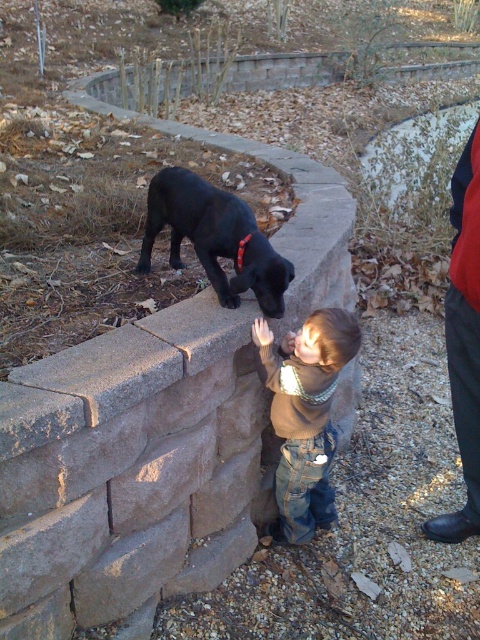
You are standing in the garden and see the black matte dog at upper center and the red fabric pants at right. Which object is positioned to the left of the other?

The black matte dog at upper center is to the left of red fabric pants at right.

You are a photographer setting up a shot of the garden scene. You notice the brown fuzzy sweater at center and the red fabric pants at right. Which object should you focus on first if you want to capture both in the same frame without moving the camera?

The brown fuzzy sweater at center is positioned under the red fabric pants at right, so focusing on the brown fuzzy sweater at center first would ensure both objects are in the frame since it is lower and the red fabric pants at right is above it.